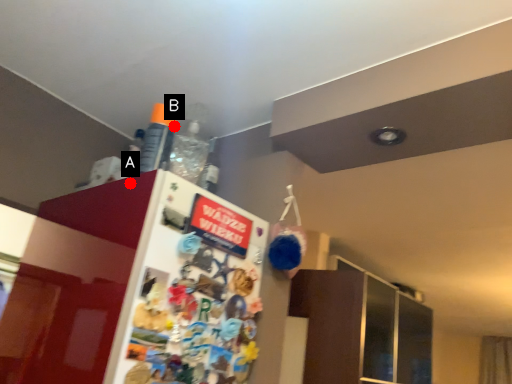
Question: Two points are circled on the image, labeled by A and B beside each circle. Which of the following is the farthest from the observer?

Choices:
 (A) A is further
 (B) B is further

Answer: (B)